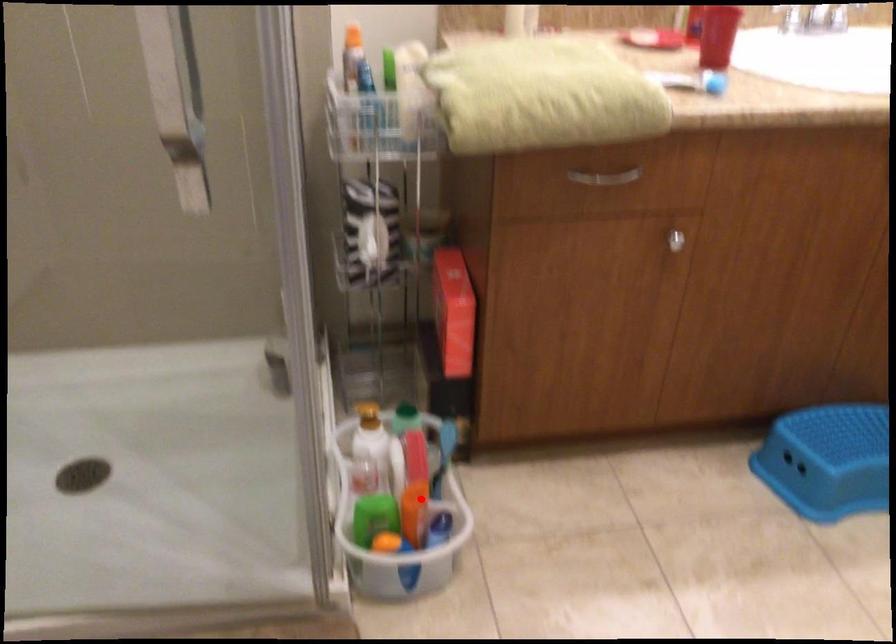
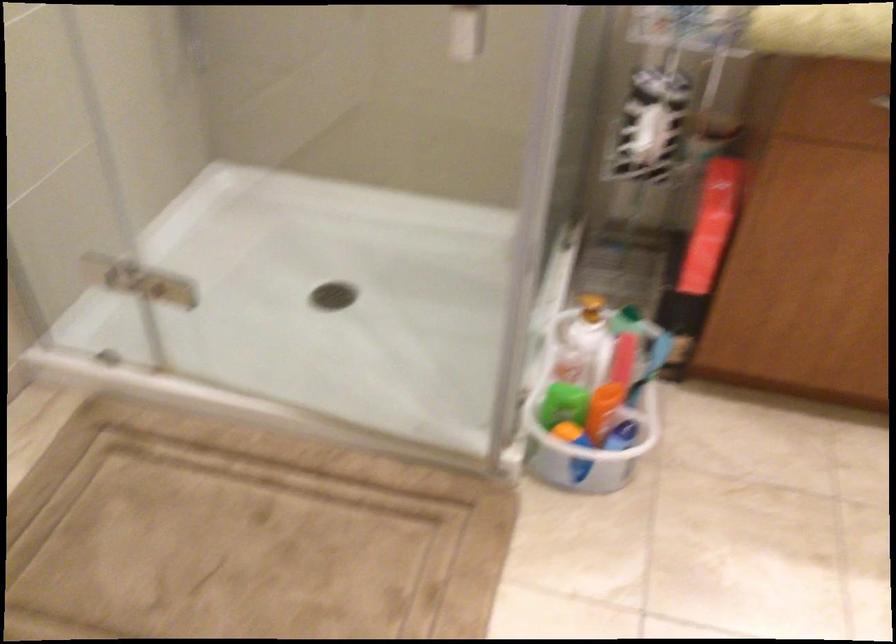
Where in the second image is the point corresponding to the highlighted location from the first image?

(610, 393)